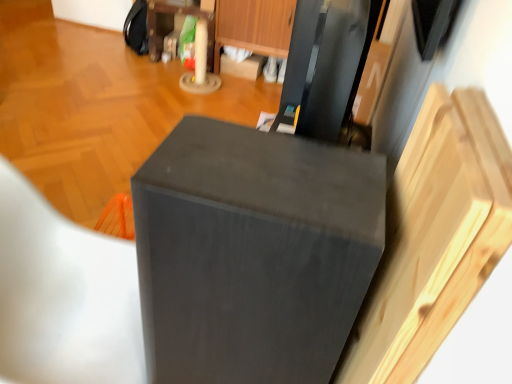
I want to click on free location above matte black speaker at center (from a real-world perspective), so click(264, 172).